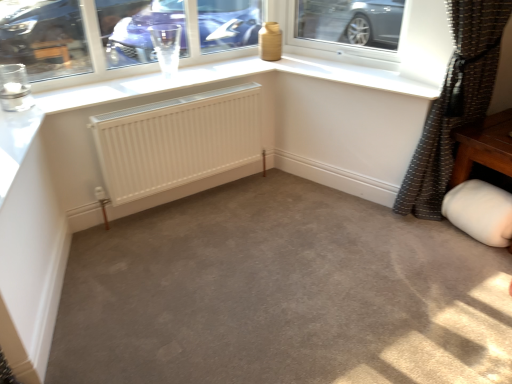
Locate an element on the screen. free point to the left of white matte jar at lower right is located at coordinates (424, 233).